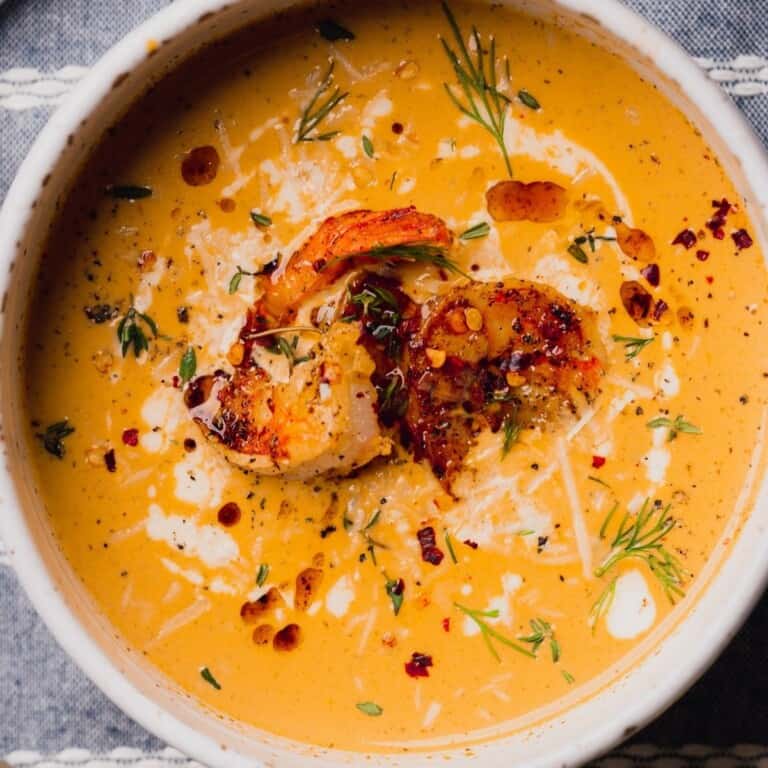
The image size is (768, 768). I want to click on white bowl edge, so click(57, 174).